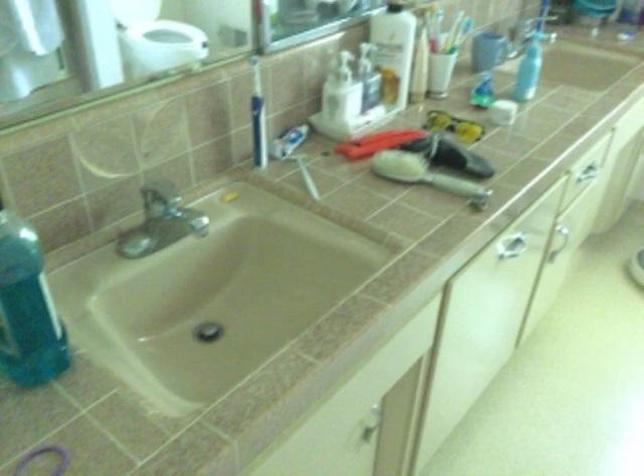
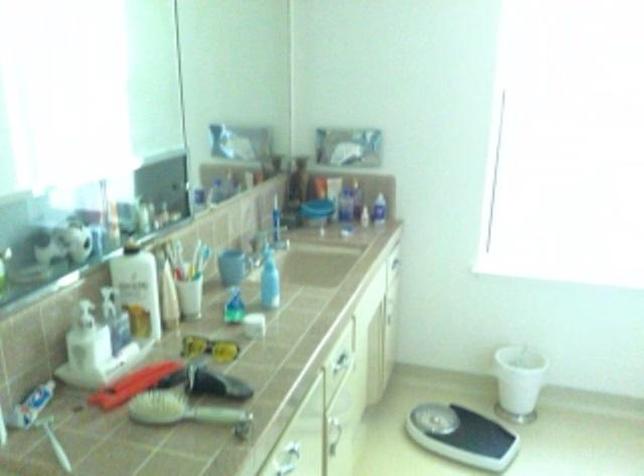
The point at (283, 141) is marked in the first image. Where is the corresponding point in the second image?

(31, 406)